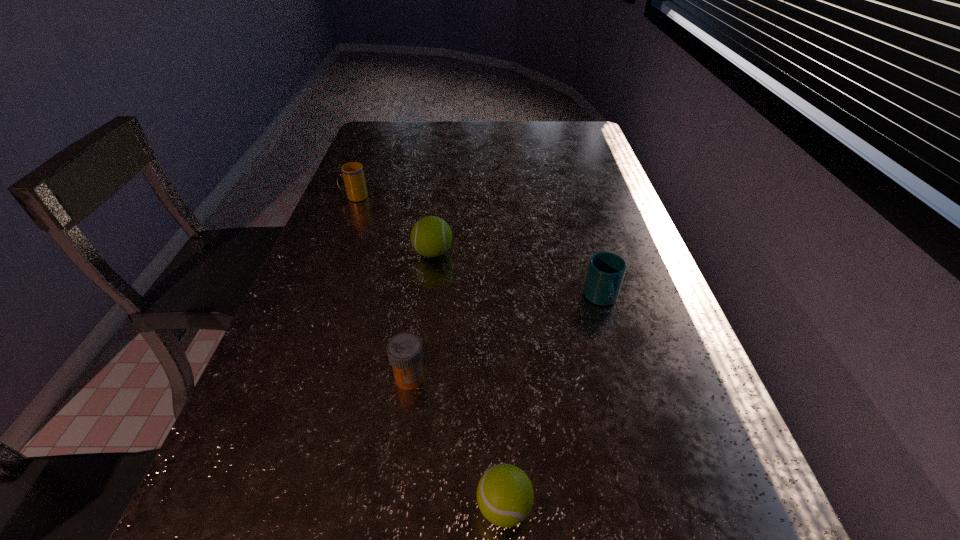
Image resolution: width=960 pixels, height=540 pixels. Identify the location of the fourth nearest object. (431, 236).

What are the coordinates of `the left tennis ball` in the screenshot? It's located at (431, 236).

This screenshot has height=540, width=960. Find the location of `the farther cup`. the farther cup is located at coordinates (355, 186).

Where is `the leftmost object`? The image size is (960, 540). the leftmost object is located at coordinates (355, 186).

Image resolution: width=960 pixels, height=540 pixels. Find the location of `the rightmost object`. the rightmost object is located at coordinates (606, 270).

The image size is (960, 540). Identify the location of the nearer cup. (606, 270).

I want to click on the fourth farthest object, so click(x=404, y=350).

Locate an element on the screen. The height and width of the screenshot is (540, 960). the nearer tennis ball is located at coordinates (505, 496).

Find the location of a particular element. the nearest object is located at coordinates (505, 496).

This screenshot has height=540, width=960. In order to click on vacant space situated 0.150m on the back of the fourth nearest object in this screenshot , I will do `click(439, 209)`.